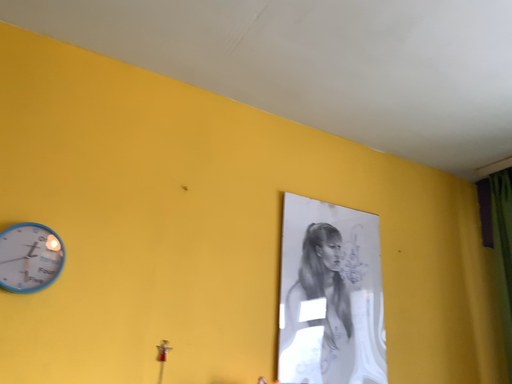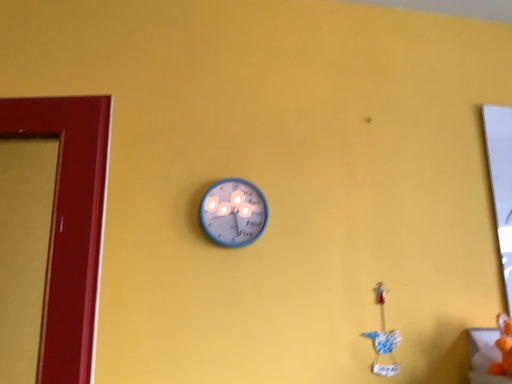
Question: Which way did the camera rotate in the video?

Choices:
 (A) rotated downward
 (B) rotated upward

Answer: (A)